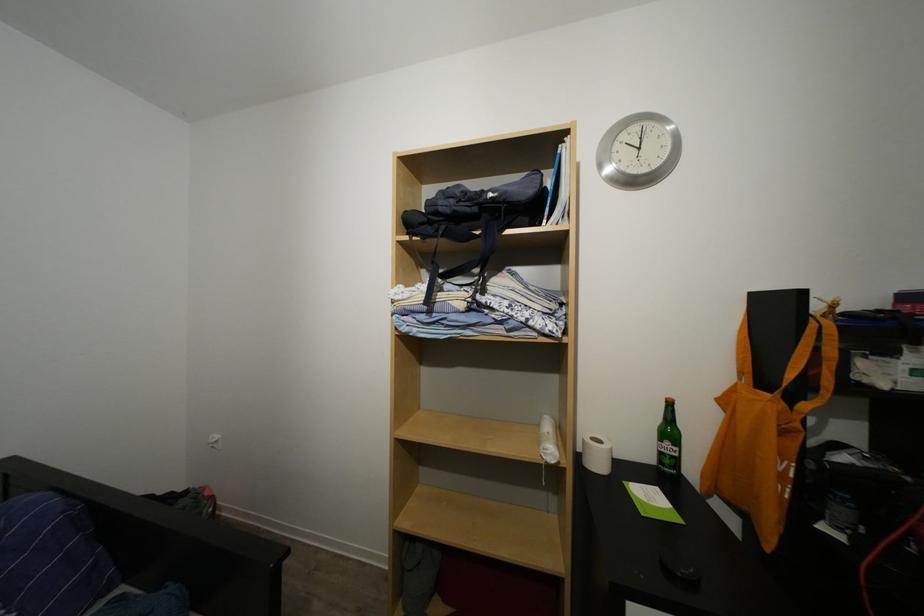
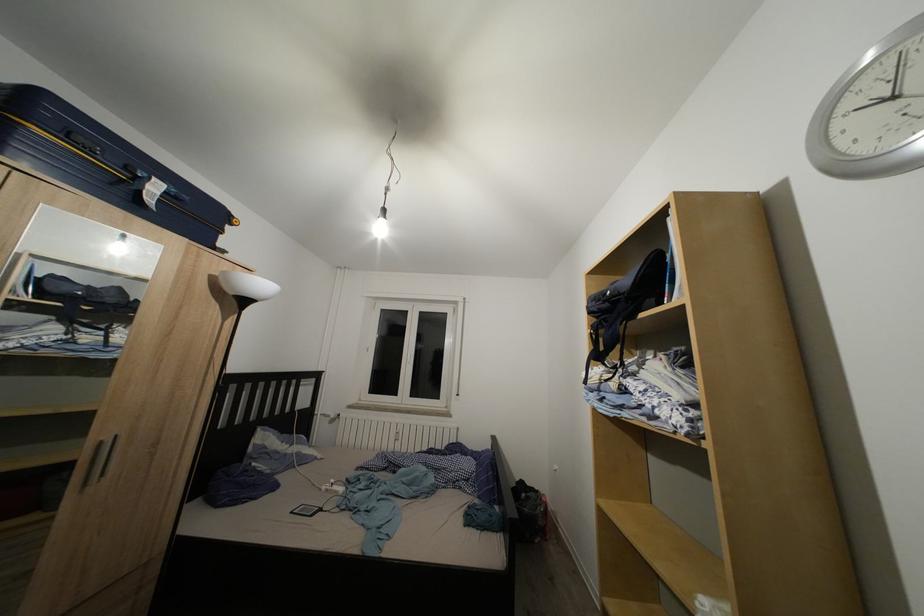
The point at (456, 217) is marked in the first image. Where is the corresponding point in the second image?

(602, 315)